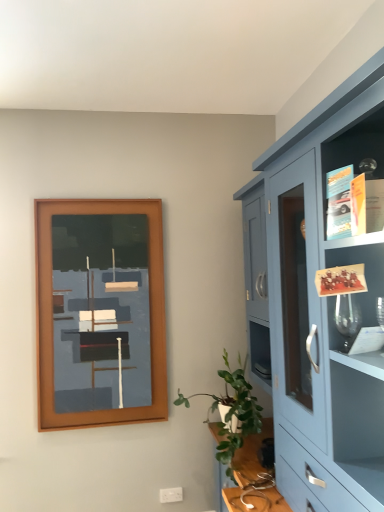
The height and width of the screenshot is (512, 384). I want to click on vacant area on top of brown wooden picture frame at upper left (from a real-world perspective), so click(92, 194).